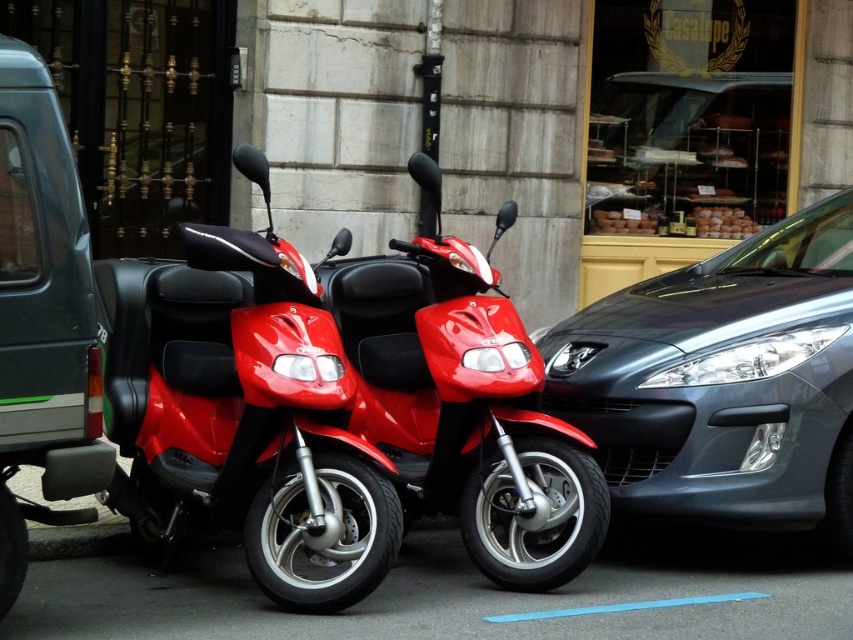
You are a delivery person needing to load a package onto your scooter. The package is 1.2 meters long. The space between the matte red scooter at center and the metallic gray car at center right is 1.5 meters. Can you safely maneuver your scooter into this space to load the package?

The space between the matte red scooter at center and the metallic gray car at center right is 1.5 meters. Since the package is 1.2 meters long, there is enough space to maneuver the scooter into the space. However, you should ensure that the package does not extend beyond the scooter and that there is clearance on both sides for safety.

You are standing at the point closest to the camera between the two scooters. Which point, point (303, 392) or point (33, 349), is closer to you?

Point (33, 349) is closer to you because it is the point nearest to the camera between the two points.

You are a delivery driver who needs to park your van between the glossy red scooter at center and the matte gray minivan at left. Can you fit your van there?

The glossy red scooter at center is to the right of matte gray minivan at left, so there is space between them. However, since the minivan is already at the left and the scooter is at the center, the space between them may be insufficient for a van. Please check the exact measurements before attempting to park.